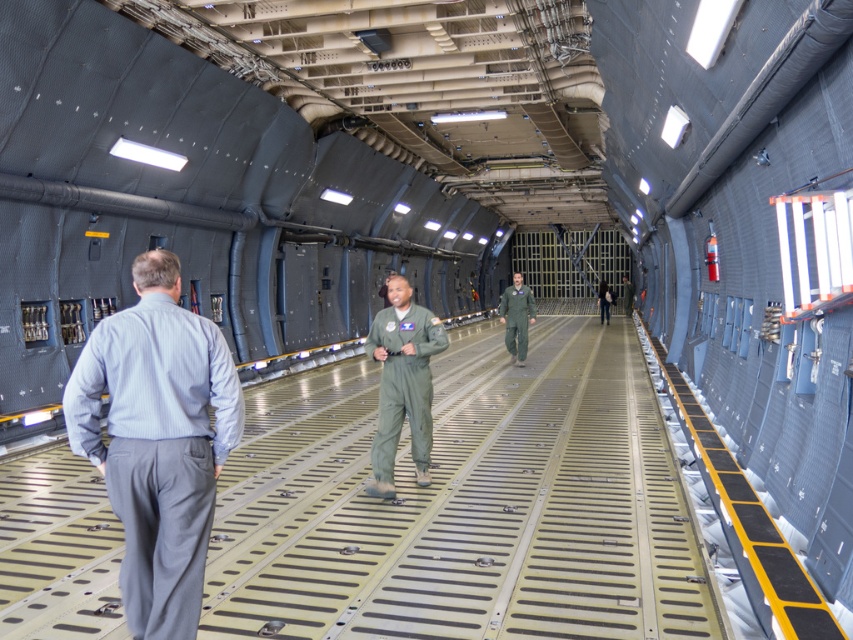
Between light blue shirt at left and green flight suit at center, which one has more height?

green flight suit at center

Does light blue shirt at left have a greater height compared to green flight suit at center?

No.

Is point (117, 346) positioned behind point (531, 301)?

No, it is in front of (531, 301).

The width and height of the screenshot is (853, 640). In order to click on light blue shirt at left in this screenshot , I will do `click(157, 440)`.

Does point (410, 305) come closer to viewer compared to point (515, 292)?

Yes.

Where is `green fabric jumpsuit at center`? This screenshot has width=853, height=640. green fabric jumpsuit at center is located at coordinates (402, 381).

In order to click on green fabric jumpsuit at center in this screenshot , I will do `click(402, 381)`.

Does light blue shirt at left have a lesser height compared to green fabric jumpsuit at center?

Correct, light blue shirt at left is not as tall as green fabric jumpsuit at center.

Consider the image. Is light blue shirt at left smaller than green fabric jumpsuit at center?

Yes.

What do you see at coordinates (157, 440) in the screenshot? The height and width of the screenshot is (640, 853). I see `light blue shirt at left` at bounding box center [157, 440].

Where is `light blue shirt at left`? This screenshot has width=853, height=640. light blue shirt at left is located at coordinates (157, 440).